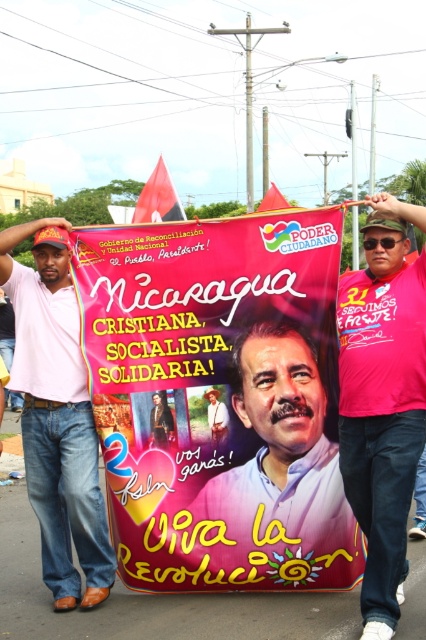
You are a photographer at the rally and want to capture both the pink fabric shirt at center and the pink cotton shirt at left in a single frame. Which shirt should you focus on to ensure both are in the frame without moving the camera?

The pink fabric shirt at center is smaller in size compared to the pink cotton shirt at left, so focusing on the pink cotton shirt at left would allow both shirts to be captured in the frame since it occupies more space and can serve as an anchor point.

You are a photographer at the rally and want to capture both the matte pink shirt at center and the pink fabric shirt at center in a single frame. What is the minimum distance you need to move backward to ensure both shirts are fully visible?

The matte pink shirt at center and the pink fabric shirt at center are 18.51 inches apart from each other. To capture both in a single frame, you need to move backward until the distance between them fits within your camera lens field of view. The exact distance depends on your camera and lens specifications, but generally, increasing the distance will widen the field of view, allowing both shirts to be captured.